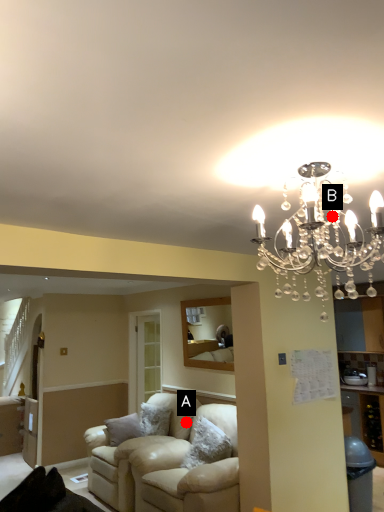
Question: Two points are circled on the image, labeled by A and B beside each circle. Which point is farther to the camera?

Choices:
 (A) A is further
 (B) B is further

Answer: (A)